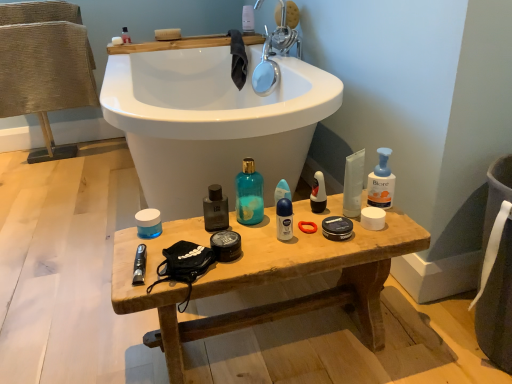
This screenshot has width=512, height=384. Find the location of `free space between translucent plastic jar at center, marked as the fifth toiletry in a back-to-front arrangement, and white matte deodorant at center, acting as the seventh toiletry starting from the back`. free space between translucent plastic jar at center, marked as the fifth toiletry in a back-to-front arrangement, and white matte deodorant at center, acting as the seventh toiletry starting from the back is located at coordinates (212, 230).